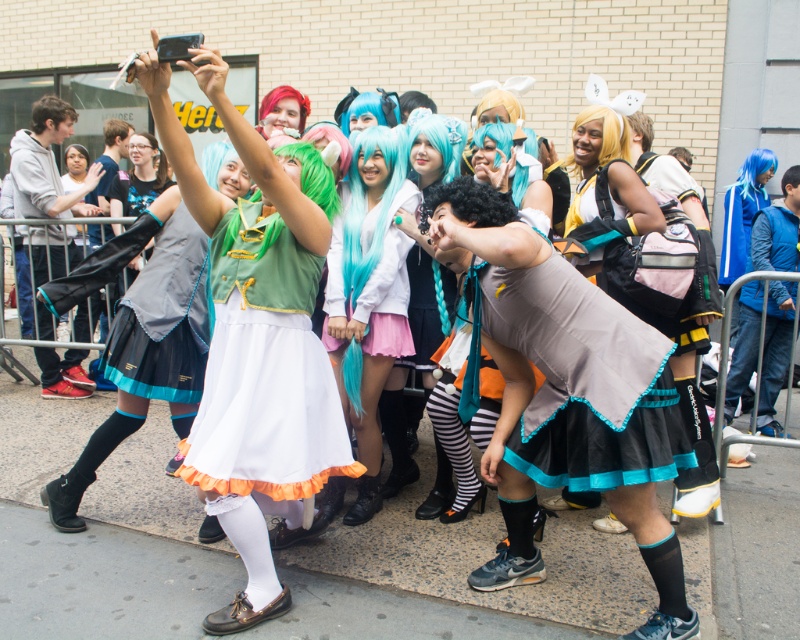
You are at a cosplay event and want to take a photo of the matte black skirt at center without the gray hoodie at left blocking it. What should you do?

The matte black skirt at center is behind the gray hoodie at left, so you should move to a position where the matte black skirt at center is in front of the gray hoodie at left to avoid blocking.

You are a photographer at the event and want to capture the teal matte wig at center in your shot. Where should you position your camera to ensure it is centered in the frame?

To center the teal matte wig at center in your frame, position your camera so that the wig aligns with the center point at coordinates approximately 0.466 on the x and 0.461 on the y axis.